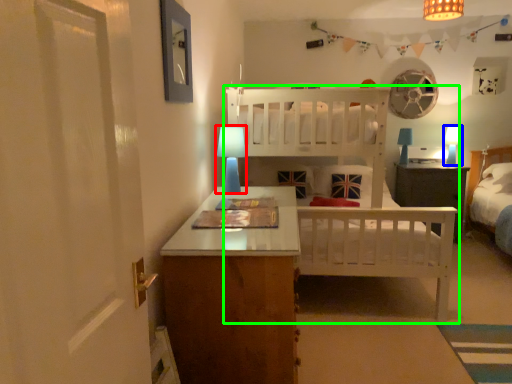
Question: Based on their relative distances, which object is nearer to table lamp (highlighted by a red box)? Choose from table lamp (highlighted by a blue box) and bed (highlighted by a green box).

Choices:
 (A) table lamp
 (B) bed

Answer: (B)